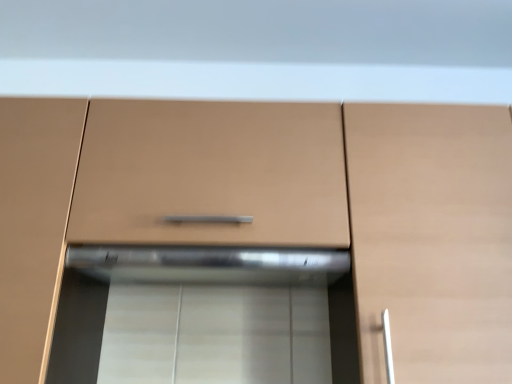
What do you see at coordinates (211, 173) in the screenshot?
I see `matte brown drawer at center` at bounding box center [211, 173].

How much space does matte wood cabinet at center, which is the first cabinetry in left-to-right order, occupy horizontally?

The width of matte wood cabinet at center, which is the first cabinetry in left-to-right order, is 15.26 inches.

Locate an element on the screen. Image resolution: width=512 pixels, height=384 pixels. matte wood cabinet at right, which is the first cabinetry in right-to-left order is located at coordinates (432, 239).

Measure the distance between point (412, 369) and camera.

Point (412, 369) is 31.77 inches away from camera.

Where is `matte brown drawer at center`? matte brown drawer at center is located at coordinates (211, 173).

From a real-world perspective, which object stands above the other?

matte brown drawer at center.

Which object is further away from the camera taking this photo, matte brown drawer at center or matte wood cabinet at right, the second cabinetry from the left?

matte brown drawer at center.

Locate an element on the screen. cabinetry that appears on the right of matte brown drawer at center is located at coordinates (432, 239).

Between matte brown drawer at center and matte wood cabinet at right, which is the first cabinetry in right-to-left order, which one has less height?

matte brown drawer at center.

Based on the photo, would you say matte wood cabinet at center, which is the first cabinetry in left-to-right order, is outside matte brown drawer at center?

Indeed, matte wood cabinet at center, which is the first cabinetry in left-to-right order, is completely outside matte brown drawer at center.

Which is more to the right, matte wood cabinet at center, which is the first cabinetry in left-to-right order, or matte brown drawer at center?

Positioned to the right is matte brown drawer at center.

From the image's perspective, does matte wood cabinet at center, the 2th cabinetry viewed from the right, appear lower than matte brown drawer at center?

Yes, from the image's perspective, matte wood cabinet at center, the 2th cabinetry viewed from the right, is below matte brown drawer at center.

Is there a large distance between matte wood cabinet at center, the 2th cabinetry viewed from the right, and matte brown drawer at center?

No, matte wood cabinet at center, the 2th cabinetry viewed from the right, is in close proximity to matte brown drawer at center.

From a real-world perspective, which object rests below the other?

In real-world perspective, matte wood cabinet at right, which is the first cabinetry in right-to-left order, is lower.

I want to click on drawer behind the matte wood cabinet at right, the second cabinetry from the left, so click(211, 173).

Considering the relative sizes of matte wood cabinet at right, which is the first cabinetry in right-to-left order, and matte brown drawer at center in the image provided, is matte wood cabinet at right, which is the first cabinetry in right-to-left order, wider than matte brown drawer at center?

Indeed, matte wood cabinet at right, which is the first cabinetry in right-to-left order, has a greater width compared to matte brown drawer at center.

Considering the sizes of objects matte wood cabinet at right, which is the first cabinetry in right-to-left order, and matte brown drawer at center in the image provided, who is shorter, matte wood cabinet at right, which is the first cabinetry in right-to-left order, or matte brown drawer at center?

matte brown drawer at center.

Can you confirm if matte wood cabinet at right, the second cabinetry from the left, is taller than matte wood cabinet at center, which is the first cabinetry in left-to-right order?

No, matte wood cabinet at right, the second cabinetry from the left, is not taller than matte wood cabinet at center, which is the first cabinetry in left-to-right order.

How distant is matte wood cabinet at right, the second cabinetry from the left, from matte wood cabinet at center, which is the first cabinetry in left-to-right order?

The distance of matte wood cabinet at right, the second cabinetry from the left, from matte wood cabinet at center, which is the first cabinetry in left-to-right order, is 29.32 inches.

Are matte wood cabinet at right, the second cabinetry from the left, and matte wood cabinet at center, which is the first cabinetry in left-to-right order, located far from each other?

matte wood cabinet at right, the second cabinetry from the left, is actually quite close to matte wood cabinet at center, which is the first cabinetry in left-to-right order.

The width and height of the screenshot is (512, 384). Identify the location of cabinetry that is behind the matte wood cabinet at center, which is the first cabinetry in left-to-right order. (432, 239).

Is matte wood cabinet at center, the 2th cabinetry viewed from the right, looking in the opposite direction of matte wood cabinet at right, the second cabinetry from the left?

No, matte wood cabinet at right, the second cabinetry from the left, is not at the back of matte wood cabinet at center, the 2th cabinetry viewed from the right.

Which is behind, point (19, 346) or point (435, 251)?

The point (435, 251) is behind.

Which object is further away from the camera taking this photo, matte wood cabinet at center, which is the first cabinetry in left-to-right order, or matte wood cabinet at right, which is the first cabinetry in right-to-left order?

matte wood cabinet at right, which is the first cabinetry in right-to-left order, is further away from the camera.

From the image's perspective, who appears lower, matte wood cabinet at center, the 2th cabinetry viewed from the right, or matte wood cabinet at right, which is the first cabinetry in right-to-left order?

From the image's view, matte wood cabinet at right, which is the first cabinetry in right-to-left order, is below.

From a real-world perspective, is matte brown drawer at center under matte wood cabinet at center, which is the first cabinetry in left-to-right order?

Actually, matte brown drawer at center is physically above matte wood cabinet at center, which is the first cabinetry in left-to-right order, in the real world.

From the image's perspective, is matte brown drawer at center positioned above or below matte wood cabinet at center, which is the first cabinetry in left-to-right order?

Clearly, from the image's perspective, matte brown drawer at center is above matte wood cabinet at center, which is the first cabinetry in left-to-right order.

Based on their sizes in the image, would you say matte brown drawer at center is bigger or smaller than matte wood cabinet at center, which is the first cabinetry in left-to-right order?

Considering their sizes, matte brown drawer at center takes up less space than matte wood cabinet at center, which is the first cabinetry in left-to-right order.

Is matte wood cabinet at center, which is the first cabinetry in left-to-right order, a part of matte brown drawer at center?

No, matte brown drawer at center does not contain matte wood cabinet at center, which is the first cabinetry in left-to-right order.

The height and width of the screenshot is (384, 512). In order to click on the 2nd cabinetry below the matte brown drawer at center (from the image's perspective) in this screenshot , I will do `click(432, 239)`.

Locate an element on the screen. The width and height of the screenshot is (512, 384). cabinetry lying on the left of matte brown drawer at center is located at coordinates (33, 221).

Consider the image. From the image, which object appears to be nearer to matte brown drawer at center, matte wood cabinet at center, which is the first cabinetry in left-to-right order, or matte wood cabinet at right, the second cabinetry from the left?

Among the two, matte wood cabinet at center, which is the first cabinetry in left-to-right order, is located nearer to matte brown drawer at center.

When comparing their distances from matte brown drawer at center, does matte wood cabinet at right, the second cabinetry from the left, or matte wood cabinet at center, which is the first cabinetry in left-to-right order, seem closer?

matte wood cabinet at center, which is the first cabinetry in left-to-right order, is positioned closer to the anchor matte brown drawer at center.

Looking at this image, based on their spatial positions, is matte brown drawer at center or matte wood cabinet at center, the 2th cabinetry viewed from the right, further from matte wood cabinet at right, which is the first cabinetry in right-to-left order?

Among the two, matte wood cabinet at center, the 2th cabinetry viewed from the right, is located further to matte wood cabinet at right, which is the first cabinetry in right-to-left order.

From the image, which object appears to be nearer to matte wood cabinet at center, which is the first cabinetry in left-to-right order, matte brown drawer at center or matte wood cabinet at right, the second cabinetry from the left?

Based on the image, matte brown drawer at center appears to be nearer to matte wood cabinet at center, which is the first cabinetry in left-to-right order.

Based on their spatial positions, is matte wood cabinet at center, the 2th cabinetry viewed from the right, or matte brown drawer at center further from matte wood cabinet at right, the second cabinetry from the left?

The object further to matte wood cabinet at right, the second cabinetry from the left, is matte wood cabinet at center, the 2th cabinetry viewed from the right.

Considering their positions, is matte wood cabinet at right, the second cabinetry from the left, positioned closer to matte wood cabinet at center, which is the first cabinetry in left-to-right order, than matte brown drawer at center?

matte brown drawer at center.

Where is `drawer between matte wood cabinet at center, which is the first cabinetry in left-to-right order, and matte wood cabinet at right, which is the first cabinetry in right-to-left order`? drawer between matte wood cabinet at center, which is the first cabinetry in left-to-right order, and matte wood cabinet at right, which is the first cabinetry in right-to-left order is located at coordinates (211, 173).